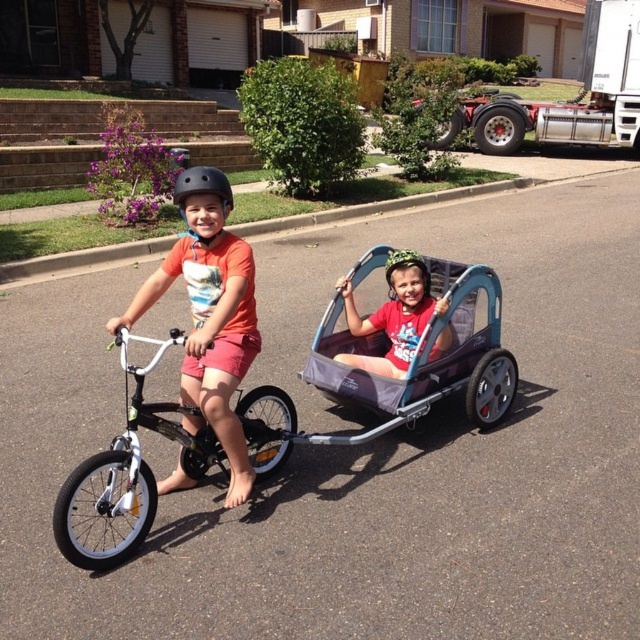
Is red cotton shirt at center below matte black helmet at center?

→ Yes, red cotton shirt at center is below matte black helmet at center.

Is point (408, 307) more distant than point (385, 275)?

No, (408, 307) is closer to viewer.

Which is behind, point (397, 349) or point (392, 256)?

Positioned behind is point (397, 349).

Where is `red cotton shirt at center`? This screenshot has height=640, width=640. red cotton shirt at center is located at coordinates (394, 314).

Between teal fabric baby carriage at center and white matte bicycle at center, which one appears on the right side from the viewer's perspective?

From the viewer's perspective, teal fabric baby carriage at center appears more on the right side.

In the scene shown: Is teal fabric baby carriage at center bigger than white matte bicycle at center?

Yes, teal fabric baby carriage at center is bigger than white matte bicycle at center.

The width and height of the screenshot is (640, 640). Describe the element at coordinates (420, 358) in the screenshot. I see `teal fabric baby carriage at center` at that location.

The image size is (640, 640). I want to click on teal fabric baby carriage at center, so click(x=420, y=358).

This screenshot has width=640, height=640. Find the location of `orange matte helmet at center`. orange matte helmet at center is located at coordinates (209, 314).

Does orange matte helmet at center have a lesser height compared to white matte bicycle at center?

No, orange matte helmet at center is not shorter than white matte bicycle at center.

At what (x,y) coordinates should I click in order to perform the action: click on orange matte helmet at center. Please return your answer as a coordinate pair (x, y). Looking at the image, I should click on (209, 314).